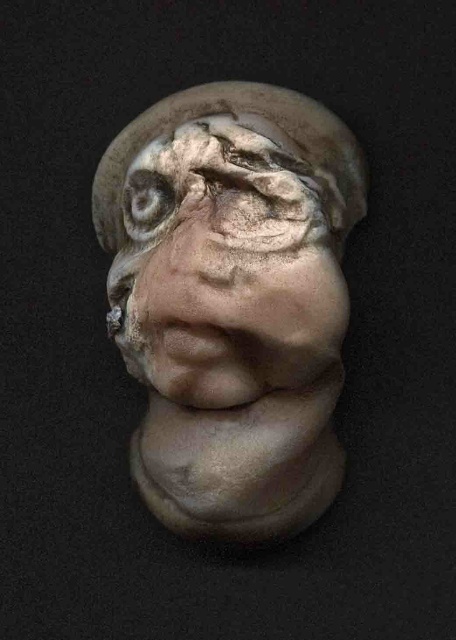
Does matte clay bust at center have a larger size compared to matte clay eye at center?

Correct, matte clay bust at center is larger in size than matte clay eye at center.

Between matte clay bust at center and matte clay eye at center, which one is positioned lower?

matte clay bust at center is lower down.

I want to click on matte clay bust at center, so click(232, 301).